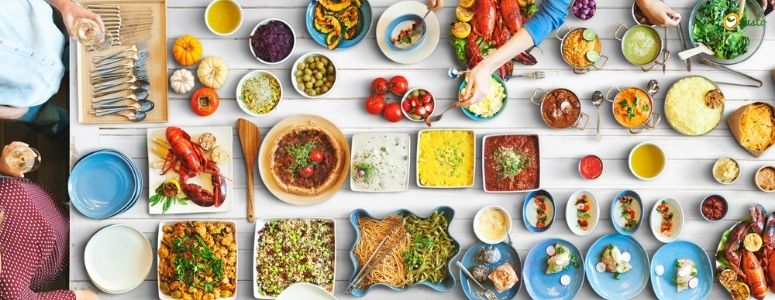
Where is `empty plate`? Image resolution: width=775 pixels, height=300 pixels. empty plate is located at coordinates (115, 277), (298, 294), (112, 192), (136, 188), (142, 182).